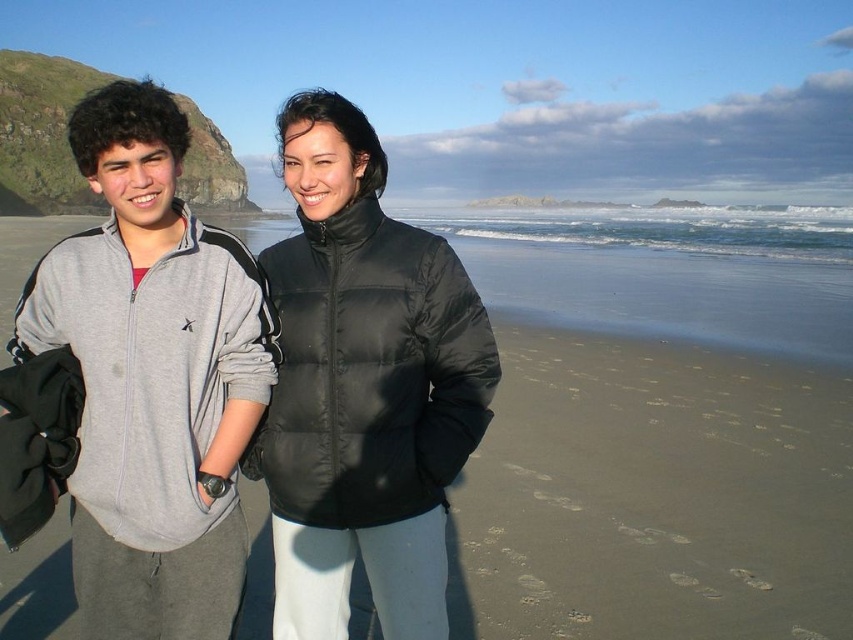
Can you confirm if sandy beach at center is wider than black puffer jacket at center?

Yes.

Which is more to the left, sandy beach at center or black puffer jacket at center?

Positioned to the left is sandy beach at center.

The width and height of the screenshot is (853, 640). What do you see at coordinates (659, 449) in the screenshot?
I see `sandy beach at center` at bounding box center [659, 449].

Image resolution: width=853 pixels, height=640 pixels. I want to click on sandy beach at center, so click(659, 449).

Who is positioned more to the left, sandy beach at center or gray fleece jacket at left?

gray fleece jacket at left is more to the left.

Is sandy beach at center to the right of gray fleece jacket at left from the viewer's perspective?

Yes, sandy beach at center is to the right of gray fleece jacket at left.

Is point (640, 451) less distant than point (167, 529)?

No.

You are a GUI agent. You are given a task and a screenshot of the screen. Output one action in this format:
    pyautogui.click(x=<x>, y=<y>)
    Task: Click on the sandy beach at center
    
    Given the screenshot: What is the action you would take?
    pyautogui.click(x=659, y=449)

Can you confirm if gray fleece jacket at left is bigger than black puffer jacket at center?

Yes, gray fleece jacket at left is bigger than black puffer jacket at center.

Describe the element at coordinates (138, 385) in the screenshot. I see `gray fleece jacket at left` at that location.

Locate an element on the screen. gray fleece jacket at left is located at coordinates (138, 385).